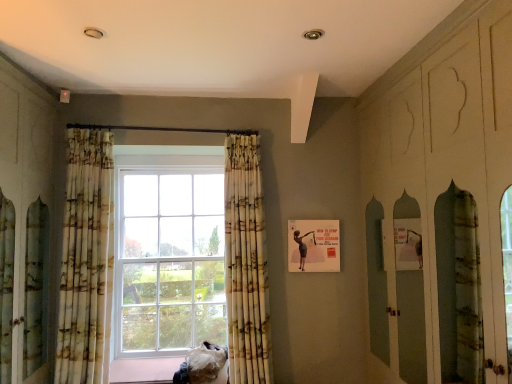
Question: From the image's perspective, does fuzzy fabric cat at lower center appear higher than printed fabric curtain at center, marked as the 2th curtain in a left-to-right arrangement?

Choices:
 (A) yes
 (B) no

Answer: (B)

Question: Is fuzzy fabric cat at lower center oriented towards printed fabric curtain at center, which is the first curtain in right-to-left order?

Choices:
 (A) yes
 (B) no

Answer: (B)

Question: Would you say printed fabric curtain at center, which is the first curtain in right-to-left order, is part of fuzzy fabric cat at lower center's contents?

Choices:
 (A) no
 (B) yes

Answer: (A)

Question: Can you confirm if fuzzy fabric cat at lower center is thinner than printed fabric curtain at center, marked as the 2th curtain in a left-to-right arrangement?

Choices:
 (A) yes
 (B) no

Answer: (B)

Question: Considering the relative positions of fuzzy fabric cat at lower center and printed fabric curtain at center, which is the first curtain in right-to-left order, in the image provided, is fuzzy fabric cat at lower center to the right of printed fabric curtain at center, which is the first curtain in right-to-left order, from the viewer's perspective?

Choices:
 (A) yes
 (B) no

Answer: (B)

Question: Is fuzzy fabric cat at lower center to the left or to the right of printed fabric curtain at center, marked as the 2th curtain in a left-to-right arrangement, in the image?

Choices:
 (A) right
 (B) left

Answer: (B)

Question: From the image's perspective, is fuzzy fabric cat at lower center located above or below printed fabric curtain at center, which is the first curtain in right-to-left order?

Choices:
 (A) below
 (B) above

Answer: (A)

Question: Based on their sizes in the image, would you say fuzzy fabric cat at lower center is bigger or smaller than printed fabric curtain at center, marked as the 2th curtain in a left-to-right arrangement?

Choices:
 (A) big
 (B) small

Answer: (B)

Question: From a real-world perspective, is fuzzy fabric cat at lower center physically located above or below printed fabric curtain at center, marked as the 2th curtain in a left-to-right arrangement?

Choices:
 (A) below
 (B) above

Answer: (A)

Question: In terms of size, does printed fabric curtain at center, marked as the 2th curtain in a left-to-right arrangement, appear bigger or smaller than printed fabric curtain at left, the 2th curtain in the right-to-left sequence?

Choices:
 (A) small
 (B) big

Answer: (A)

Question: Considering their positions, is printed fabric curtain at center, marked as the 2th curtain in a left-to-right arrangement, located in front of or behind printed fabric curtain at left, the 2th curtain in the right-to-left sequence?

Choices:
 (A) front
 (B) behind

Answer: (B)

Question: From the image's perspective, is printed fabric curtain at center, which is the first curtain in right-to-left order, located above or below printed fabric curtain at left, the 2th curtain in the right-to-left sequence?

Choices:
 (A) below
 (B) above

Answer: (A)

Question: Would you say printed fabric curtain at center, marked as the 2th curtain in a left-to-right arrangement, is to the left or to the right of printed fabric curtain at left, which is the first curtain in left-to-right order, in the picture?

Choices:
 (A) right
 (B) left

Answer: (A)

Question: In terms of width, does fuzzy fabric cat at lower center look wider or thinner when compared to printed fabric curtain at left, which is the first curtain in left-to-right order?

Choices:
 (A) wide
 (B) thin

Answer: (A)

Question: Based on their positions, is fuzzy fabric cat at lower center located to the left or right of printed fabric curtain at left, which is the first curtain in left-to-right order?

Choices:
 (A) left
 (B) right

Answer: (B)